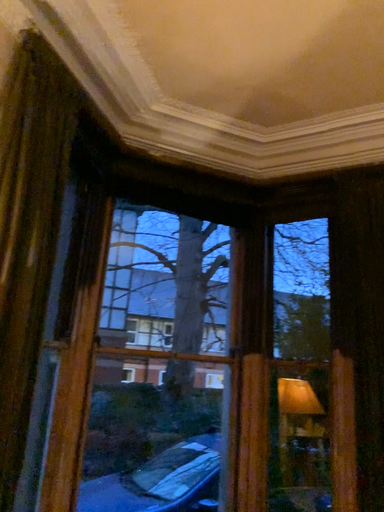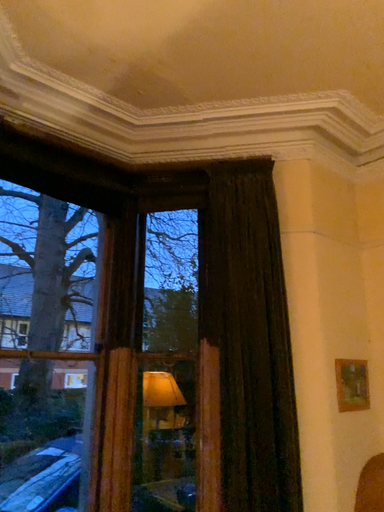
Question: How did the camera likely rotate when shooting the video?

Choices:
 (A) rotated right
 (B) rotated left

Answer: (A)